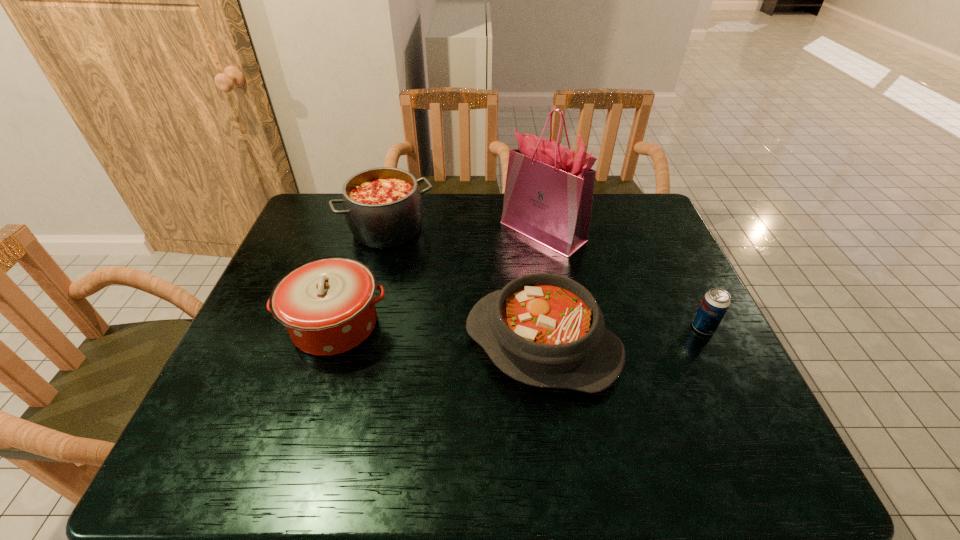
Identify the location of shopping bag. The width and height of the screenshot is (960, 540). (548, 197).

Image resolution: width=960 pixels, height=540 pixels. I want to click on the farthest casserole, so tap(383, 207).

This screenshot has width=960, height=540. Identify the location of the rightmost casserole. (546, 330).

At what (x,y) coordinates should I click in order to perform the action: click on the rightmost object. Please return your answer as a coordinate pair (x, y). Looking at the image, I should click on (715, 303).

Find the location of a particular element. Image resolution: width=960 pixels, height=540 pixels. vacant region located on the front of the shopping bag is located at coordinates (564, 349).

Where is `vacant area situated on the right of the farthest casserole`? vacant area situated on the right of the farthest casserole is located at coordinates (555, 229).

Where is `free region located 0.290m on the left of the shortest casserole`? The width and height of the screenshot is (960, 540). free region located 0.290m on the left of the shortest casserole is located at coordinates (347, 344).

Locate an element on the screen. vacant space located 0.210m on the front of the beer can is located at coordinates (745, 413).

The height and width of the screenshot is (540, 960). I want to click on shopping bag that is positioned at the far edge, so click(548, 197).

Find the location of `casserole situated at the far edge`. casserole situated at the far edge is located at coordinates (383, 207).